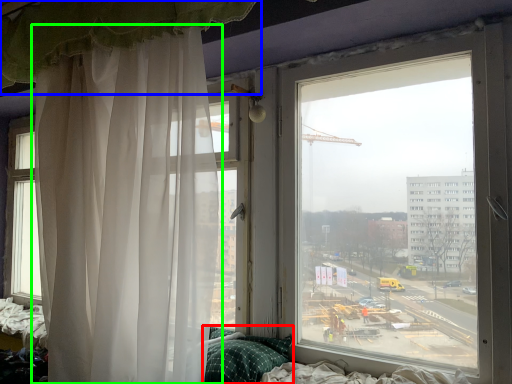
Question: Estimate the real-world distances between objects in this image. Which object is closer to pillow (highlighted by a red box), curtain (highlighted by a blue box) or curtain (highlighted by a green box)?

Choices:
 (A) curtain
 (B) curtain

Answer: (B)